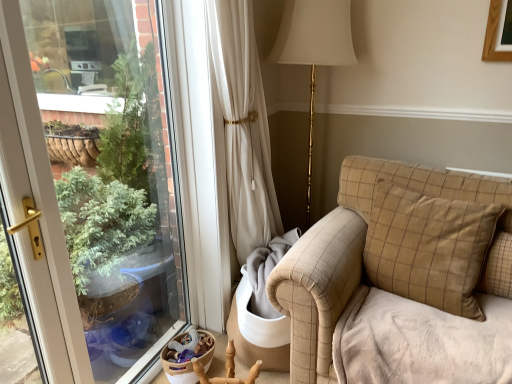
Question: Is point (283, 276) closer or farther from the camera than point (256, 372)?

Choices:
 (A) closer
 (B) farther

Answer: (A)

Question: From a real-world perspective, is beige checkered couch at right physically located above or below wooden armchair at lower center?

Choices:
 (A) above
 (B) below

Answer: (A)

Question: Which is farther from the wooden armchair at lower center?

Choices:
 (A) beige checkered pillow at right
 (B) beige checkered couch at right

Answer: (A)

Question: Estimate the real-world distances between objects in this image. Which object is closer to the beige checkered couch at right?

Choices:
 (A) beige checkered pillow at right
 (B) wooden armchair at lower center

Answer: (A)